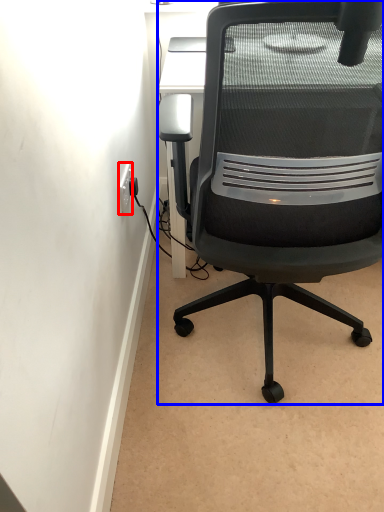
Question: Which of the following is the closest to the observer, electric outlet (highlighted by a red box) or chair (highlighted by a blue box)?

Choices:
 (A) electric outlet
 (B) chair

Answer: (B)